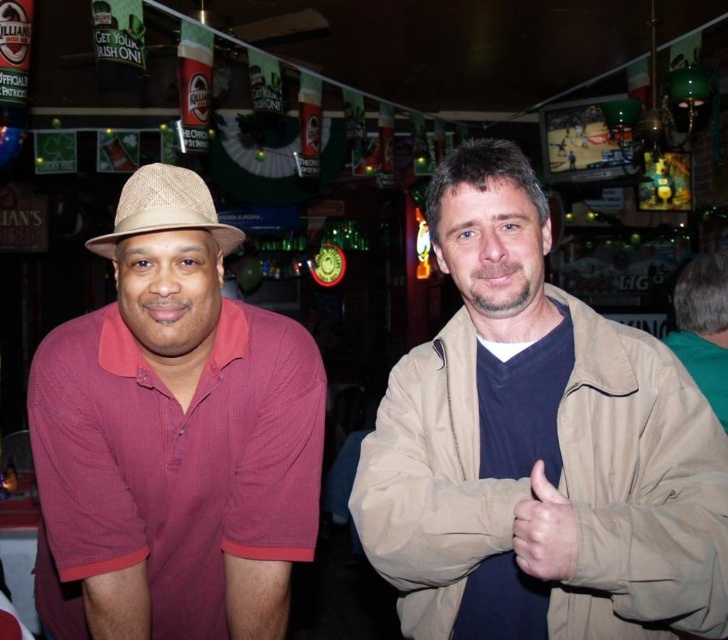
Question: Is tan fabric jacket at right in front of tan woven fedora at left?

Choices:
 (A) yes
 (B) no

Answer: (A)

Question: Considering the real-world distances, which object is farthest from the matte red shirt at left?

Choices:
 (A) tan woven fedora at left
 (B) smooth beige hand at center
 (C) tan fabric jacket at right

Answer: (B)

Question: Which is farther from the tan woven fedora at left?

Choices:
 (A) matte red shirt at left
 (B) smooth beige hand at center

Answer: (B)

Question: Is tan fabric jacket at right bigger than matte red shirt at left?

Choices:
 (A) yes
 (B) no

Answer: (B)

Question: Considering the relative positions of matte red shirt at left and smooth beige hand at center in the image provided, where is matte red shirt at left located with respect to smooth beige hand at center?

Choices:
 (A) right
 (B) left

Answer: (B)

Question: Which object is farther from the camera taking this photo?

Choices:
 (A) tan woven fedora at left
 (B) smooth beige hand at center
 (C) matte red shirt at left

Answer: (A)